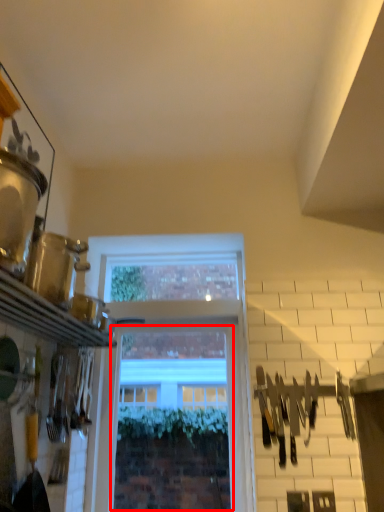
Question: From the image, what is the correct spatial relationship of window (annotated by the red box) in relation to tool?

Choices:
 (A) left
 (B) right

Answer: (A)